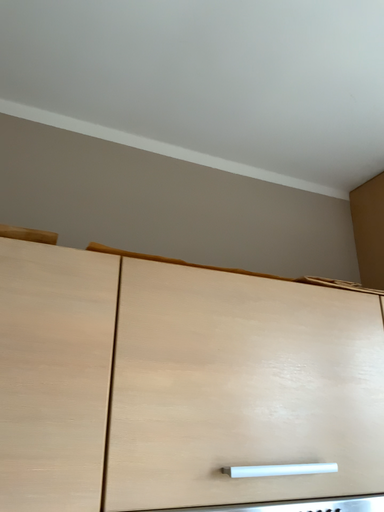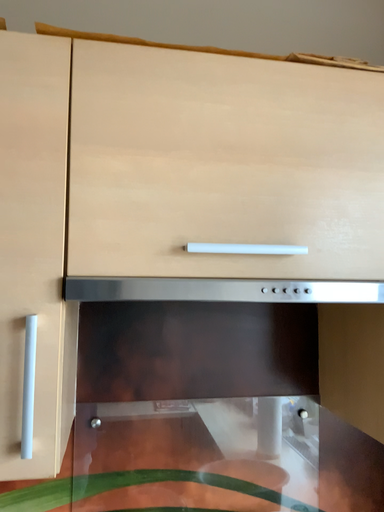
Question: How did the camera likely rotate when shooting the video?

Choices:
 (A) rotated downward
 (B) rotated upward

Answer: (A)